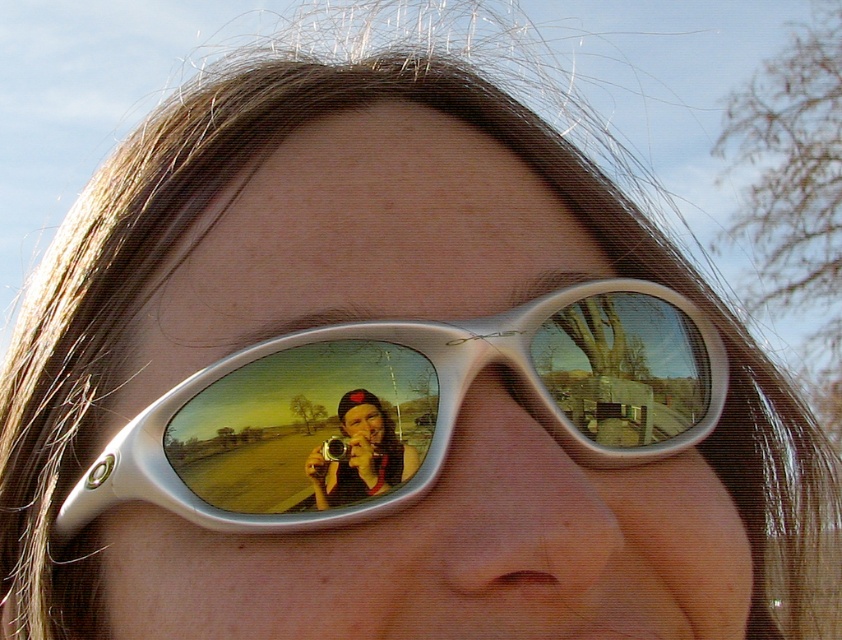
Question: Which point is closer to the camera?

Choices:
 (A) (350, 454)
 (B) (613, 464)

Answer: (A)

Question: Is white glossy sunglasses at center smaller than metallic silver camera at center?

Choices:
 (A) no
 (B) yes

Answer: (A)

Question: Is white glossy sunglasses at center above metallic silver camera at center?

Choices:
 (A) no
 (B) yes

Answer: (B)

Question: Which of the following is the closest to the observer?

Choices:
 (A) (555, 320)
 (B) (364, 396)

Answer: (B)

Question: Which of the following is the closest to the observer?

Choices:
 (A) (355, 406)
 (B) (321, 481)

Answer: (B)

Question: Is white glossy sunglasses at center bigger than metallic silver camera at center?

Choices:
 (A) yes
 (B) no

Answer: (A)